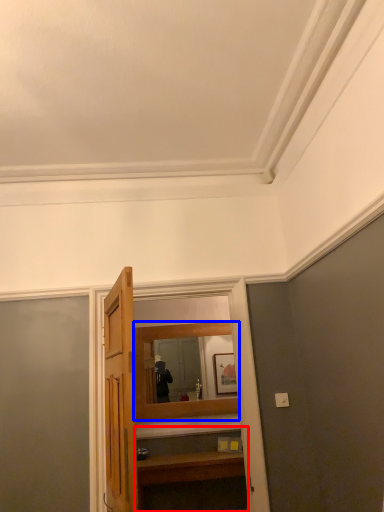
Question: Which of the following is the closest to the observer, vanity (highlighted by a red box) or mirror (highlighted by a blue box)?

Choices:
 (A) vanity
 (B) mirror

Answer: (A)